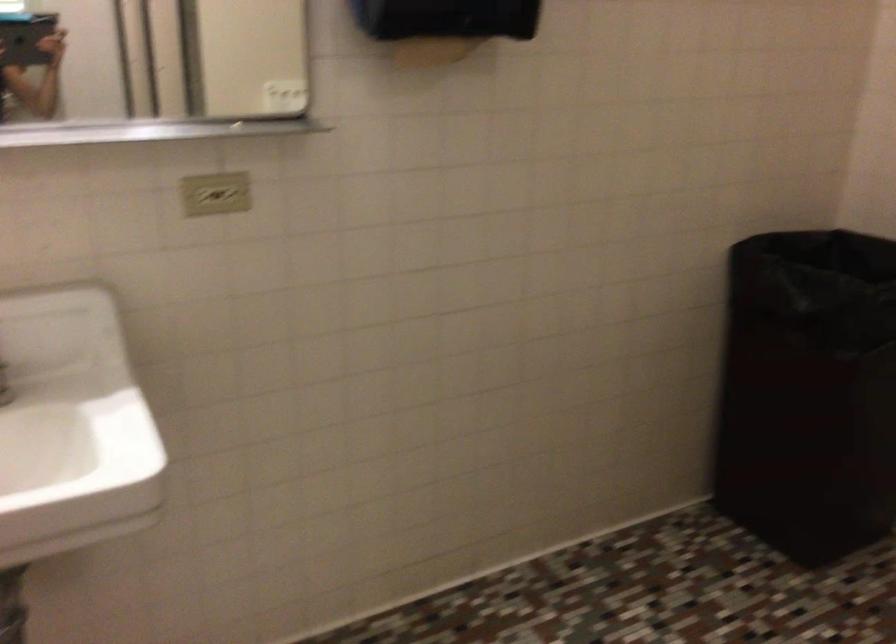
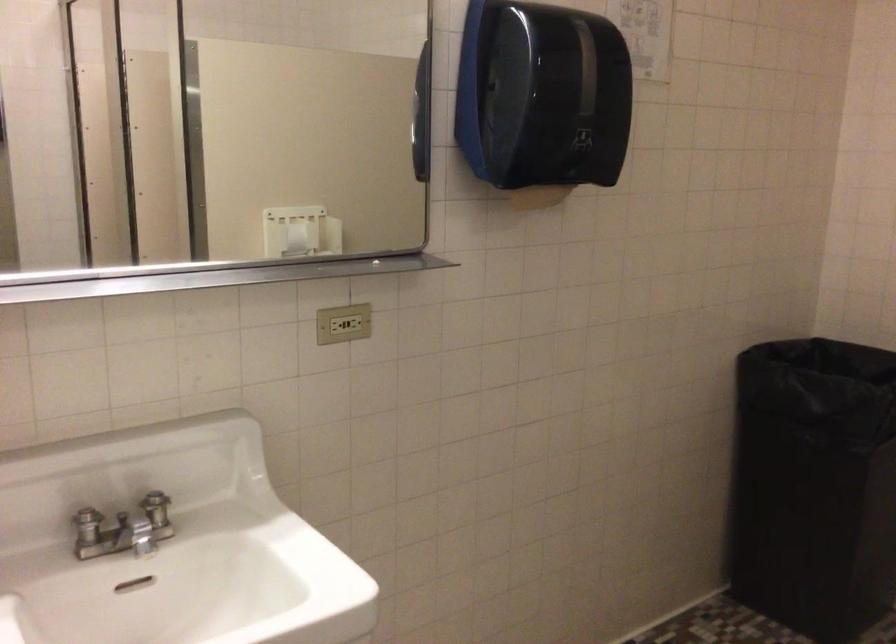
Question: Which direction would the cameraman need to move to produce the second image? Reply with the corresponding letter.

Choices:
 (A) Left
 (B) Right
 (C) Forward
 (D) Backward

Answer: (A)